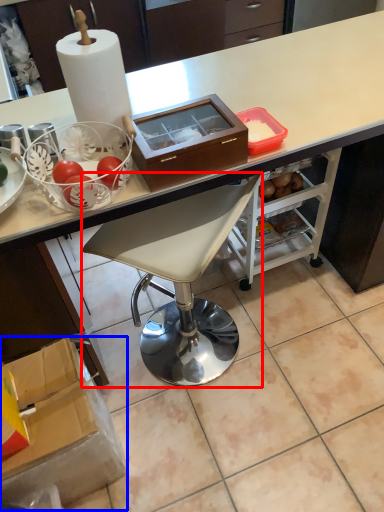
Question: Which object is closer to the camera taking this photo, chair (highlighted by a red box) or box (highlighted by a blue box)?

Choices:
 (A) chair
 (B) box

Answer: (A)